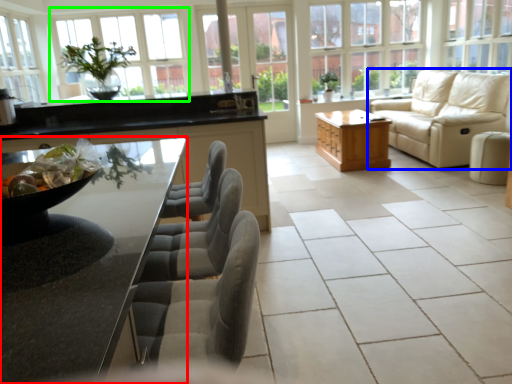
Question: Which object is the farthest from countertop (highlighted by a red box)? Choose among these: studio couch (highlighted by a blue box) or window (highlighted by a green box).

Choices:
 (A) studio couch
 (B) window

Answer: (B)